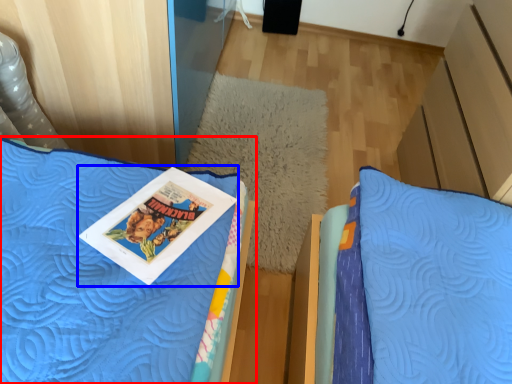
Question: Which object appears farthest to the camera in this image, bed (highlighted by a red box) or comic book (highlighted by a blue box)?

Choices:
 (A) bed
 (B) comic book

Answer: (B)